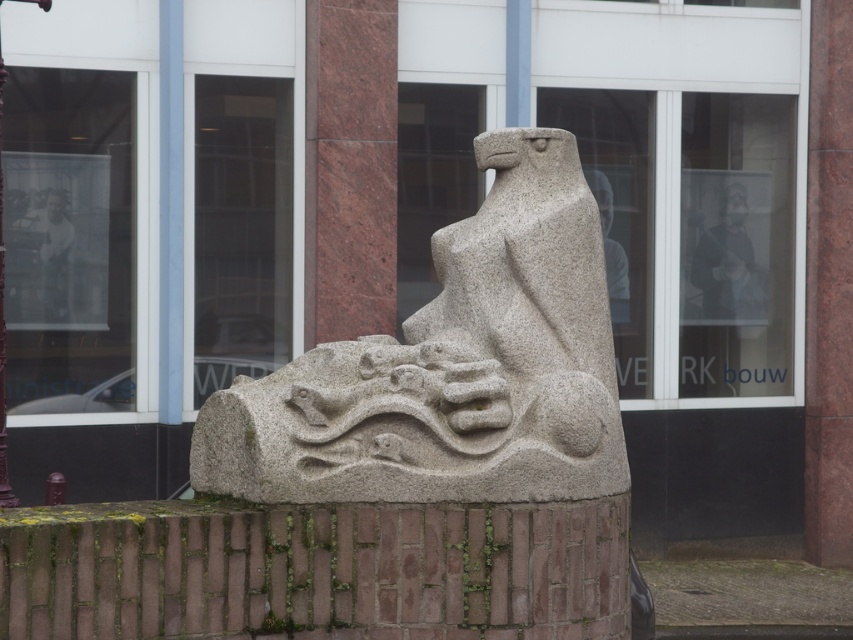
Question: Can you confirm if granite statue at center is bigger than dark gray fabric jacket at upper center?

Choices:
 (A) yes
 (B) no

Answer: (A)

Question: Which object appears closest to the camera in this image?

Choices:
 (A) granite statue at center
 (B) dark gray fabric jacket at upper center

Answer: (A)

Question: Which object is farther from the camera taking this photo?

Choices:
 (A) dark gray fabric jacket at upper center
 (B) granite statue at center

Answer: (A)

Question: Can you confirm if granite statue at center is positioned above dark gray fabric jacket at upper center?

Choices:
 (A) no
 (B) yes

Answer: (A)

Question: Which of the following is the farthest from the observer?

Choices:
 (A) (717, 276)
 (B) (612, 593)

Answer: (A)

Question: Can you confirm if granite statue at center is positioned to the right of dark gray fabric jacket at upper center?

Choices:
 (A) yes
 (B) no

Answer: (B)